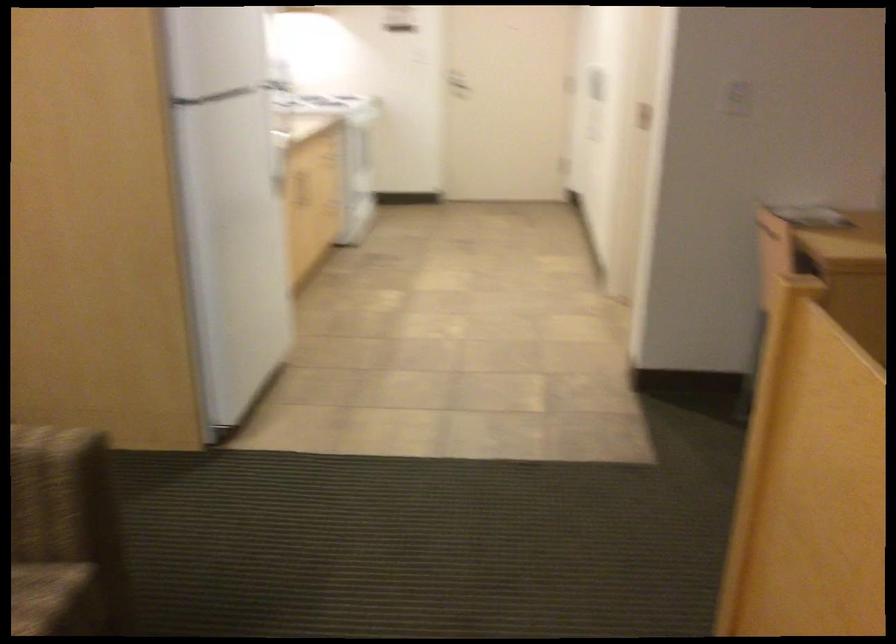
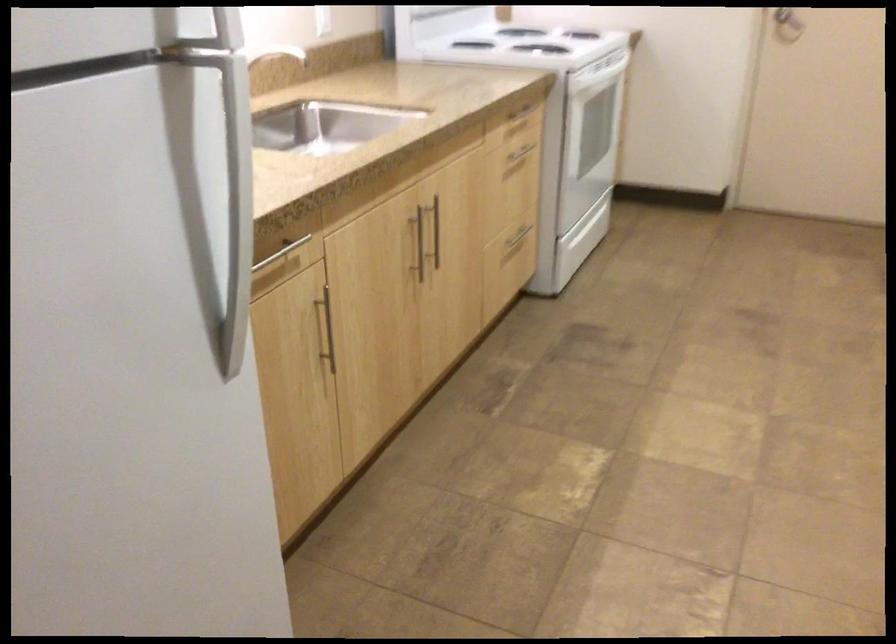
Question: Which direction would the cameraman need to move to produce the second image? Reply with the corresponding letter.

Choices:
 (A) Left
 (B) Right
 (C) Forward
 (D) Backward

Answer: (C)